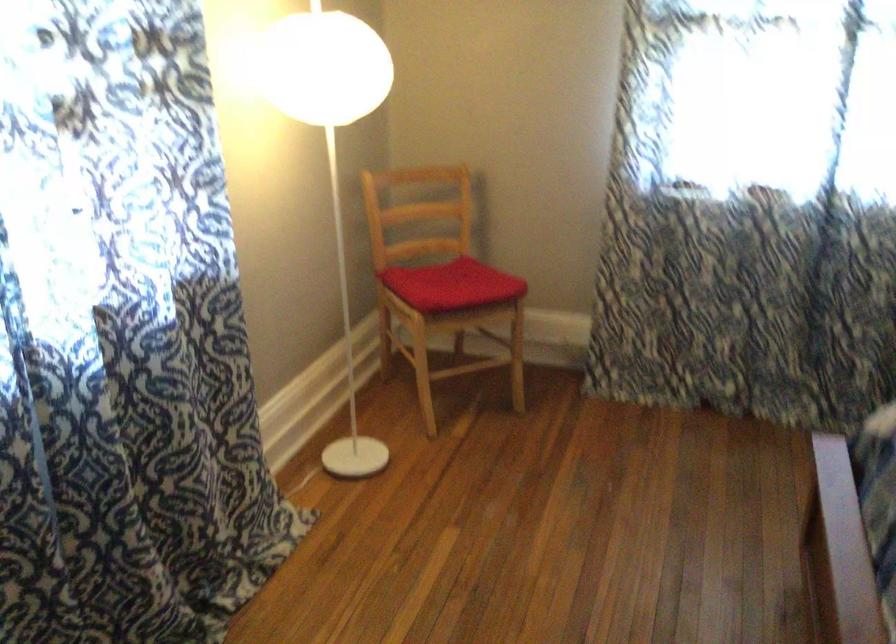
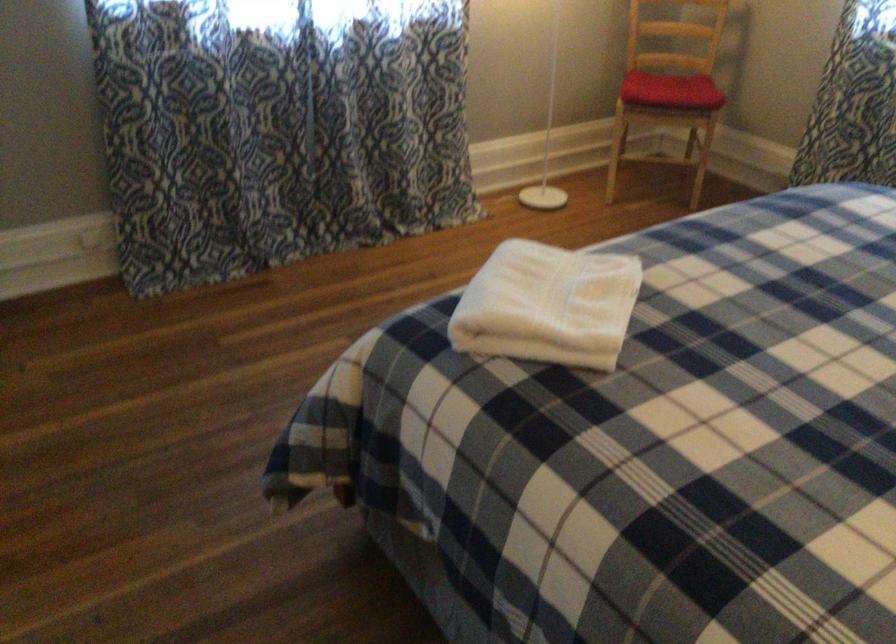
Locate, in the second image, the point that corresponds to (x=463, y=298) in the first image.

(670, 90)